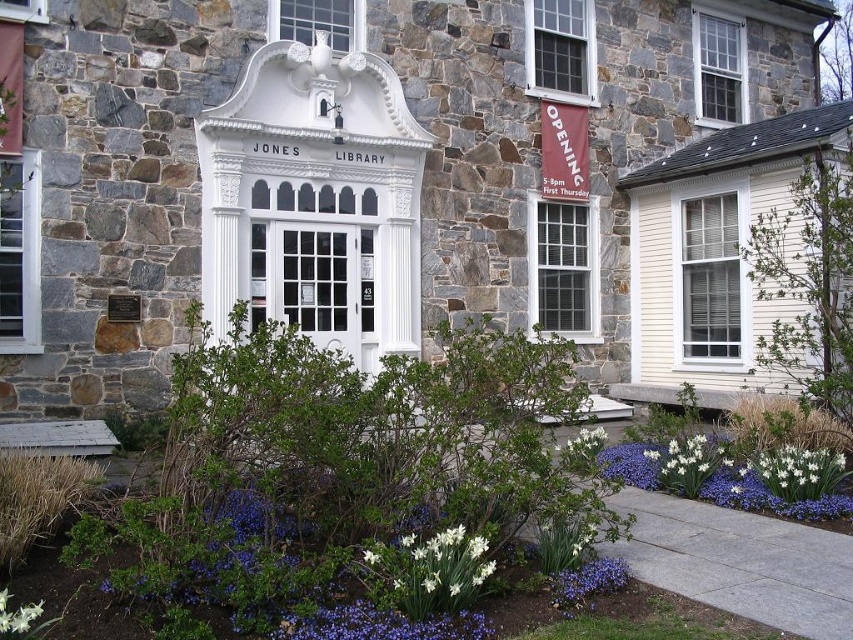
Can you confirm if white glossy flower at center is shorter than white glossy flower at lower right?

No.

Is white glossy flower at center wider than white glossy flower at lower right?

No, white glossy flower at center is not wider than white glossy flower at lower right.

Who is more forward, (431,589) or (807,493)?

Point (431,589) is more forward.

This screenshot has width=853, height=640. I want to click on white glossy flower at center, so click(432, 566).

Who is higher up, white glossy flower at center or blue matte flower at lower center?

Positioned higher is white glossy flower at center.

Does white glossy flower at center appear over blue matte flower at lower center?

Indeed, white glossy flower at center is positioned over blue matte flower at lower center.

Between point (453, 528) and point (625, 582), which one is positioned in front?

Point (453, 528) is in front.

This screenshot has width=853, height=640. What are the coordinates of `white glossy flower at center` in the screenshot? It's located at (432, 566).

Does white glossy flower at center appear on the left side of white matte flower at center?

Indeed, white glossy flower at center is positioned on the left side of white matte flower at center.

Image resolution: width=853 pixels, height=640 pixels. Find the location of `white glossy flower at center`. white glossy flower at center is located at coordinates (432, 566).

I want to click on white glossy flower at center, so click(432, 566).